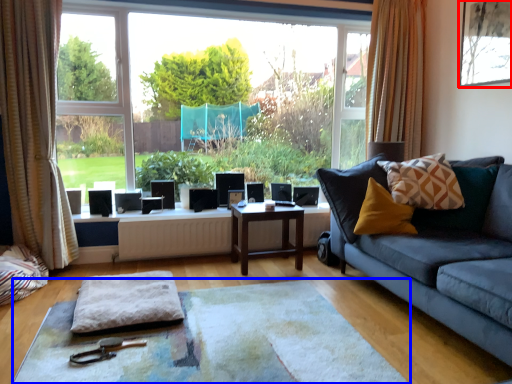
Question: Among these objects, which one is nearest to the camera, picture frame (highlighted by a red box) or flat (highlighted by a blue box)?

Choices:
 (A) picture frame
 (B) flat

Answer: (B)